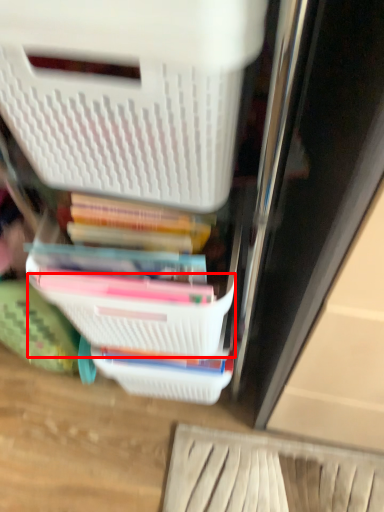
Question: In this image, where is basket (annotated by the red box) located relative to storage box?

Choices:
 (A) left
 (B) right

Answer: (B)